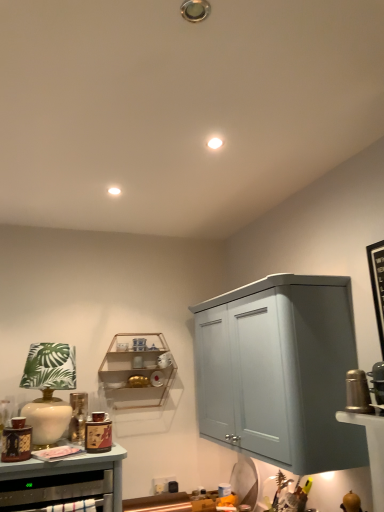
Question: From the image's perspective, is white ceramic table lamp at left under matte brown cabinet at lower left?

Choices:
 (A) yes
 (B) no

Answer: (B)

Question: Is white ceramic table lamp at left positioned behind matte brown cabinet at lower left?

Choices:
 (A) no
 (B) yes

Answer: (B)

Question: Is white ceramic table lamp at left outside of matte brown cabinet at lower left?

Choices:
 (A) yes
 (B) no

Answer: (A)

Question: Does white ceramic table lamp at left appear on the left side of matte brown cabinet at lower left?

Choices:
 (A) no
 (B) yes

Answer: (B)

Question: Does white ceramic table lamp at left have a lesser width compared to matte brown cabinet at lower left?

Choices:
 (A) yes
 (B) no

Answer: (A)

Question: In terms of height, does wooden shelf at center look taller or shorter compared to white ceramic table lamp at left?

Choices:
 (A) tall
 (B) short

Answer: (B)

Question: Do you think wooden shelf at center is within white ceramic table lamp at left, or outside of it?

Choices:
 (A) outside
 (B) inside

Answer: (A)

Question: From a real-world perspective, relative to white ceramic table lamp at left, is wooden shelf at center vertically above or below?

Choices:
 (A) below
 (B) above

Answer: (B)

Question: Considering the relative positions of wooden shelf at center and white ceramic table lamp at left in the image provided, is wooden shelf at center to the left or to the right of white ceramic table lamp at left?

Choices:
 (A) right
 (B) left

Answer: (A)

Question: Would you say white ceramic table lamp at left is inside or outside wooden shelf at center?

Choices:
 (A) outside
 (B) inside

Answer: (A)

Question: In terms of height, does white ceramic table lamp at left look taller or shorter compared to wooden shelf at center?

Choices:
 (A) tall
 (B) short

Answer: (A)

Question: In the image, is white ceramic table lamp at left positioned in front of or behind wooden shelf at center?

Choices:
 (A) front
 (B) behind

Answer: (A)

Question: Is point coord(49,360) closer or farther from the camera than point coord(160,366)?

Choices:
 (A) farther
 (B) closer

Answer: (B)

Question: Is matte brown cabinet at lower left inside the boundaries of wooden shelf at center, or outside?

Choices:
 (A) outside
 (B) inside

Answer: (A)

Question: Relative to wooden shelf at center, is matte brown cabinet at lower left in front or behind?

Choices:
 (A) behind
 (B) front

Answer: (B)